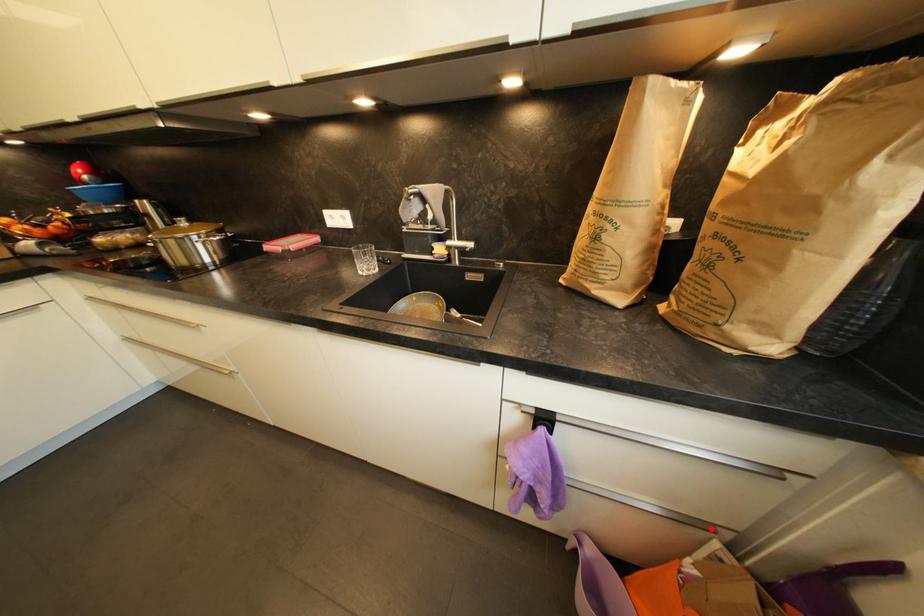
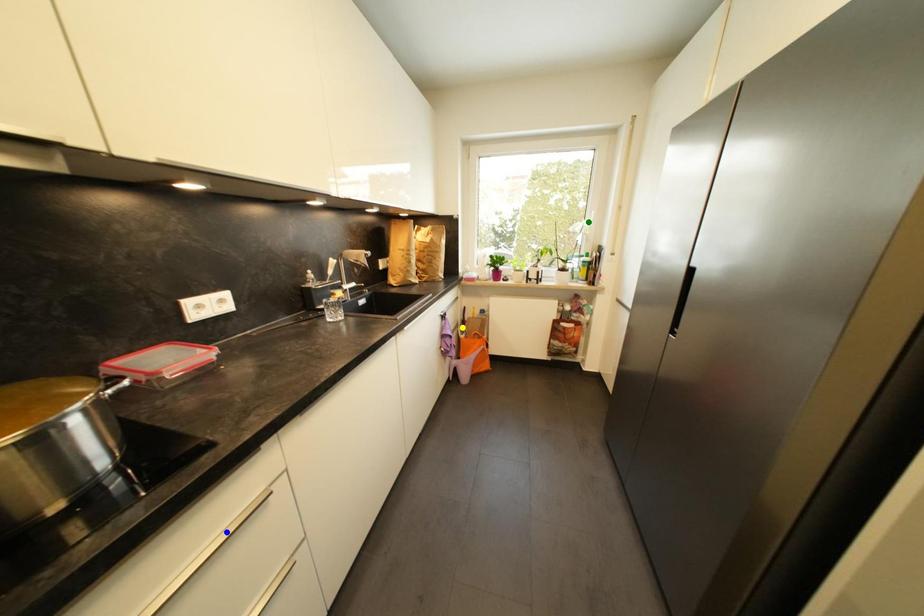
Question: I am providing you with two images of the same scene from different viewpoints. A red point is marked on the first image. You are given multiple points on the second image. Which mark in image 2 goes with the point in image 1?

Choices:
 (A) blue point
 (B) green point
 (C) yellow point

Answer: (C)